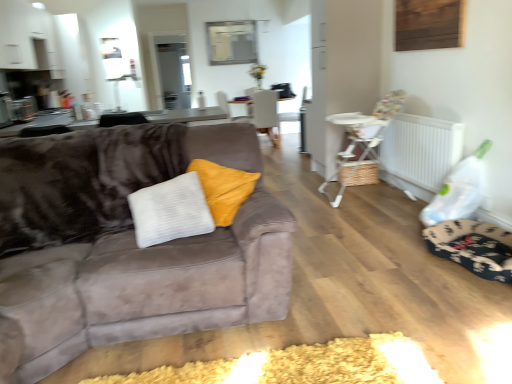
Question: Should I look upward or downward to see white plastic highchair at right, the 1th chair from the front?

Choices:
 (A) down
 (B) up

Answer: (B)

Question: From a real-world perspective, is matte gray chair at center, which is the first chair in left-to-right order, positioned over floral fabric dog bed at lower right based on gravity?

Choices:
 (A) no
 (B) yes

Answer: (B)

Question: Is matte gray chair at center, which is the first chair in left-to-right order, closer to the viewer compared to floral fabric dog bed at lower right?

Choices:
 (A) yes
 (B) no

Answer: (B)

Question: Considering the relative sizes of matte gray chair at center, which is the 2th chair from front to back, and floral fabric dog bed at lower right in the image provided, is matte gray chair at center, which is the 2th chair from front to back, bigger than floral fabric dog bed at lower right?

Choices:
 (A) no
 (B) yes

Answer: (B)

Question: Is matte gray chair at center, which is the first chair in left-to-right order, facing away from floral fabric dog bed at lower right?

Choices:
 (A) yes
 (B) no

Answer: (A)

Question: From the image's perspective, is matte gray chair at center, which is counted as the first chair, starting from the back, on top of floral fabric dog bed at lower right?

Choices:
 (A) yes
 (B) no

Answer: (A)

Question: Is matte gray chair at center, which is the 2th chair from front to back, thinner than floral fabric dog bed at lower right?

Choices:
 (A) no
 (B) yes

Answer: (A)

Question: Is white woven basket at center taller than suede couch at left?

Choices:
 (A) no
 (B) yes

Answer: (A)

Question: Are white woven basket at center and suede couch at left far apart?

Choices:
 (A) yes
 (B) no

Answer: (A)

Question: Can you confirm if white woven basket at center is smaller than suede couch at left?

Choices:
 (A) no
 (B) yes

Answer: (B)

Question: Is white woven basket at center shorter than suede couch at left?

Choices:
 (A) no
 (B) yes

Answer: (B)

Question: From the image's perspective, is white woven basket at center on top of suede couch at left?

Choices:
 (A) yes
 (B) no

Answer: (A)

Question: Is white woven basket at center thinner than suede couch at left?

Choices:
 (A) yes
 (B) no

Answer: (A)

Question: Is white plastic radiator at right thinner than suede couch at left?

Choices:
 (A) no
 (B) yes

Answer: (B)